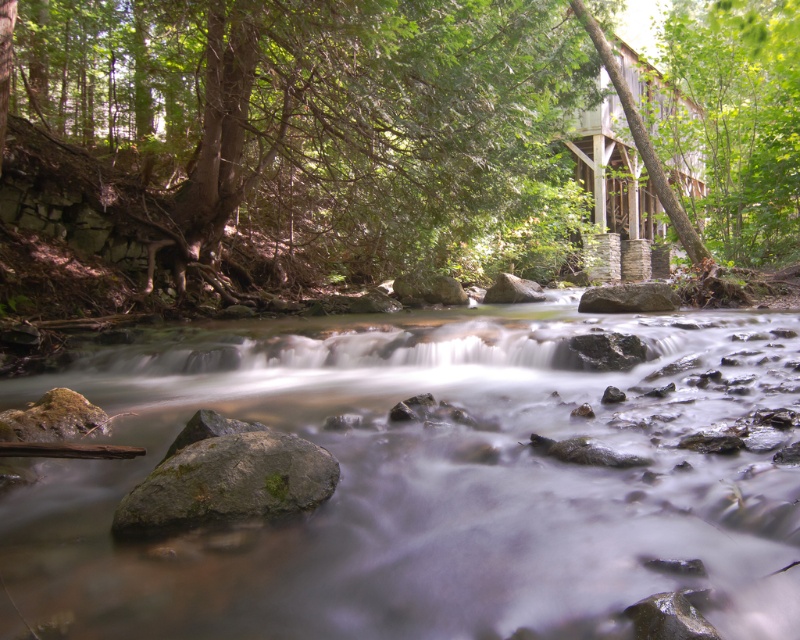
Is clear water at center wider than green leafy tree at upper center?

No, clear water at center is not wider than green leafy tree at upper center.

Between clear water at center and green leafy tree at upper center, which one is positioned lower?

clear water at center

Describe the element at coordinates (432, 486) in the screenshot. Image resolution: width=800 pixels, height=640 pixels. I see `clear water at center` at that location.

The width and height of the screenshot is (800, 640). Identify the location of clear water at center. (432, 486).

Can you confirm if green mossy rock at center is bigger than green mossy rock at lower left?

No.

This screenshot has height=640, width=800. I want to click on green mossy rock at center, so click(x=226, y=483).

Image resolution: width=800 pixels, height=640 pixels. What are the coordinates of `green mossy rock at center` in the screenshot? It's located at click(x=226, y=483).

How far apart are smooth gray rock at center and gray smooth rock at center?

smooth gray rock at center is 1.14 meters away from gray smooth rock at center.

This screenshot has height=640, width=800. I want to click on smooth gray rock at center, so click(x=430, y=289).